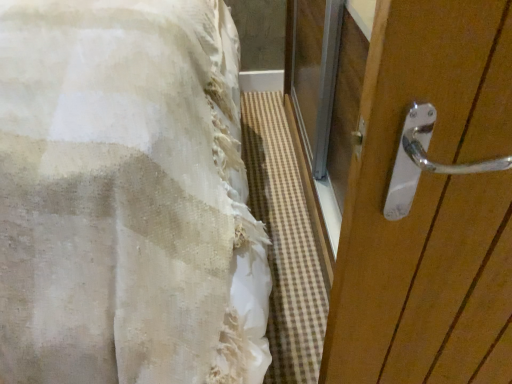
Question: From the image's perspective, is white textured fabric at left above or below polished wood door handle at right?

Choices:
 (A) below
 (B) above

Answer: (A)

Question: Visually, is white textured fabric at left positioned to the left or to the right of polished wood door handle at right?

Choices:
 (A) right
 (B) left

Answer: (B)

Question: Is white textured fabric at left bigger or smaller than polished wood door handle at right?

Choices:
 (A) small
 (B) big

Answer: (B)

Question: From the image's perspective, is polished wood door handle at right above or below white textured fabric at left?

Choices:
 (A) above
 (B) below

Answer: (A)

Question: Is polished wood door handle at right in front of or behind white textured fabric at left in the image?

Choices:
 (A) front
 (B) behind

Answer: (B)

Question: In terms of height, does polished wood door handle at right look taller or shorter compared to white textured fabric at left?

Choices:
 (A) short
 (B) tall

Answer: (A)

Question: From a real-world perspective, is polished wood door handle at right physically located above or below white textured fabric at left?

Choices:
 (A) below
 (B) above

Answer: (A)